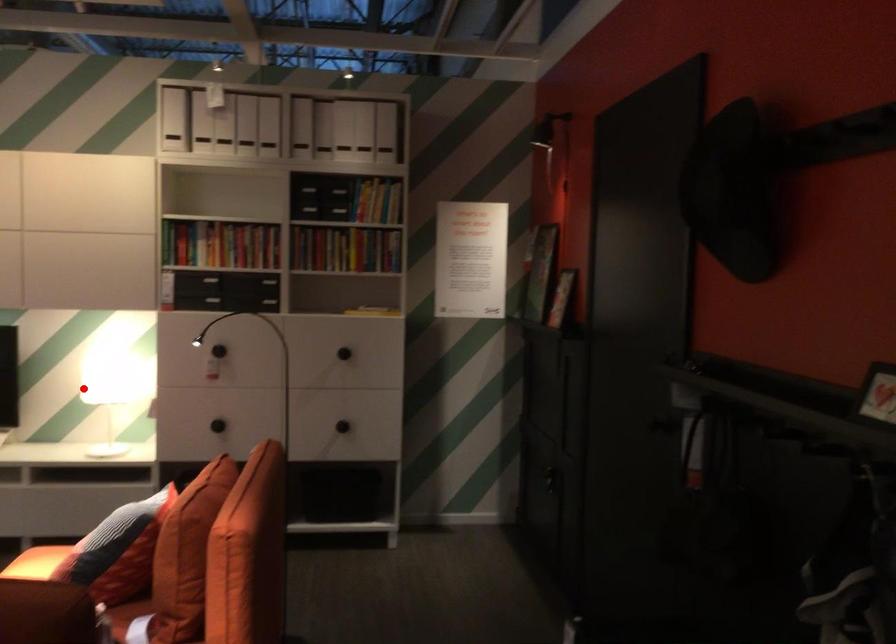
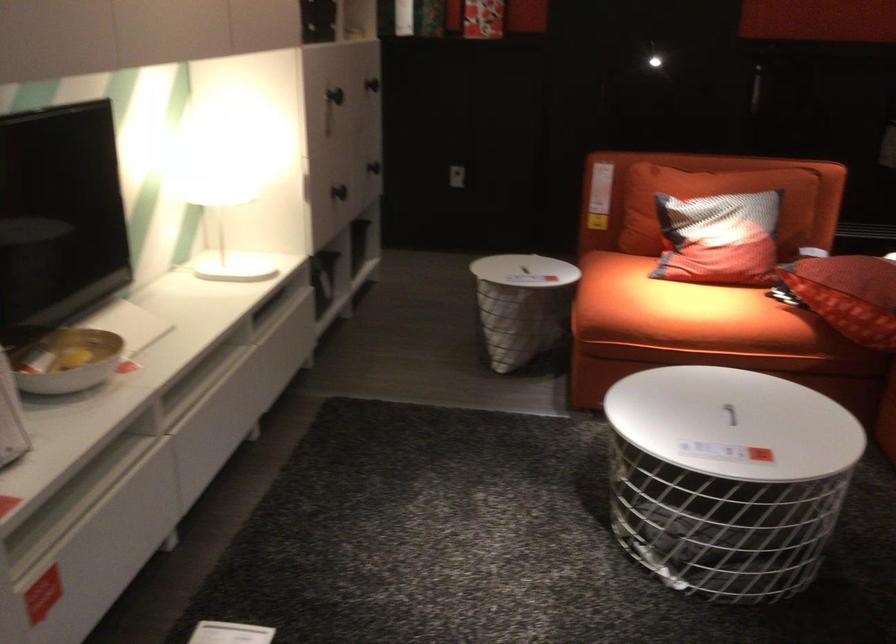
Question: I am providing you with two images of the same scene from different viewpoints. Given a red point in image1, look at the same physical point in image2. Is it:

Choices:
 (A) Closer to the viewpoint
 (B) Farther from the viewpoint

Answer: (A)